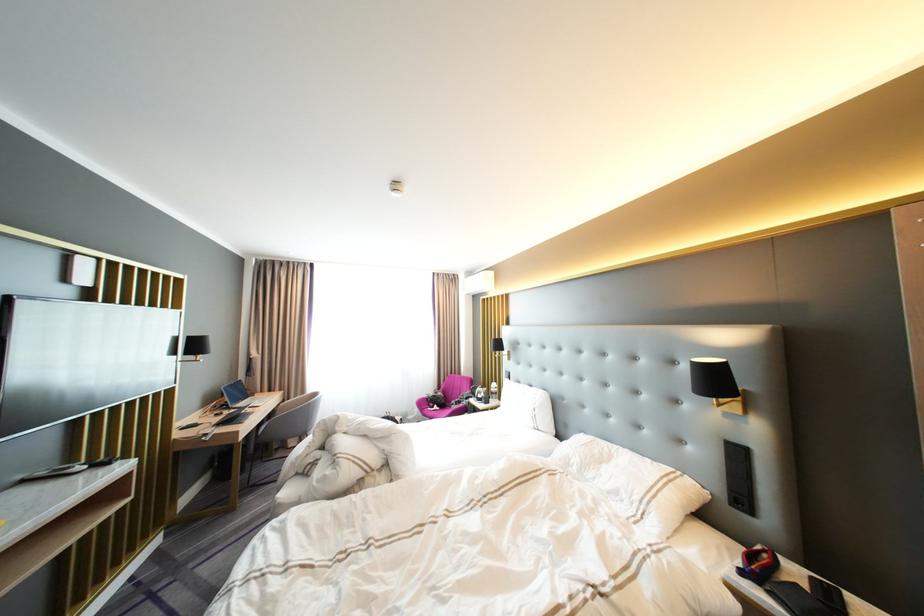
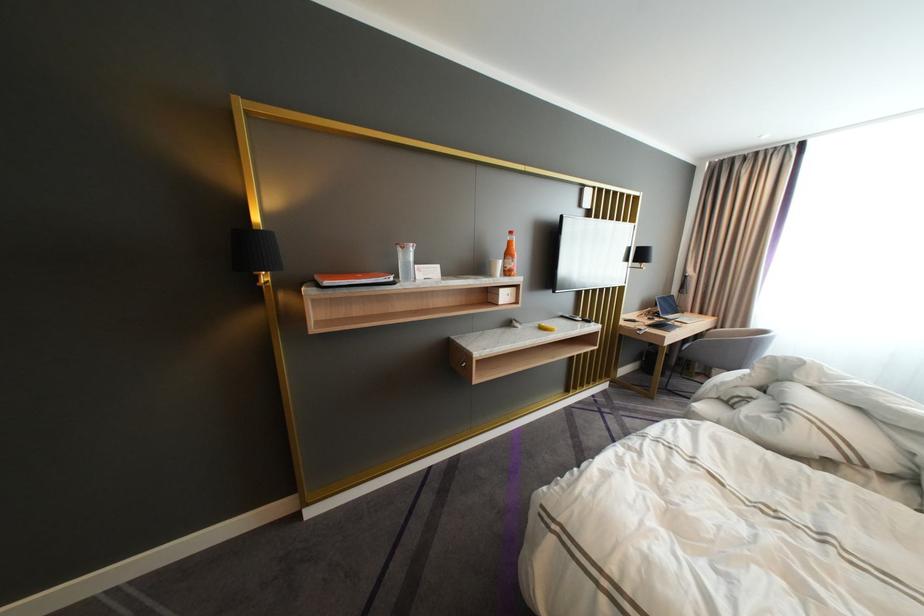
The point at (54, 474) is marked in the first image. Where is the corresponding point in the second image?

(578, 315)